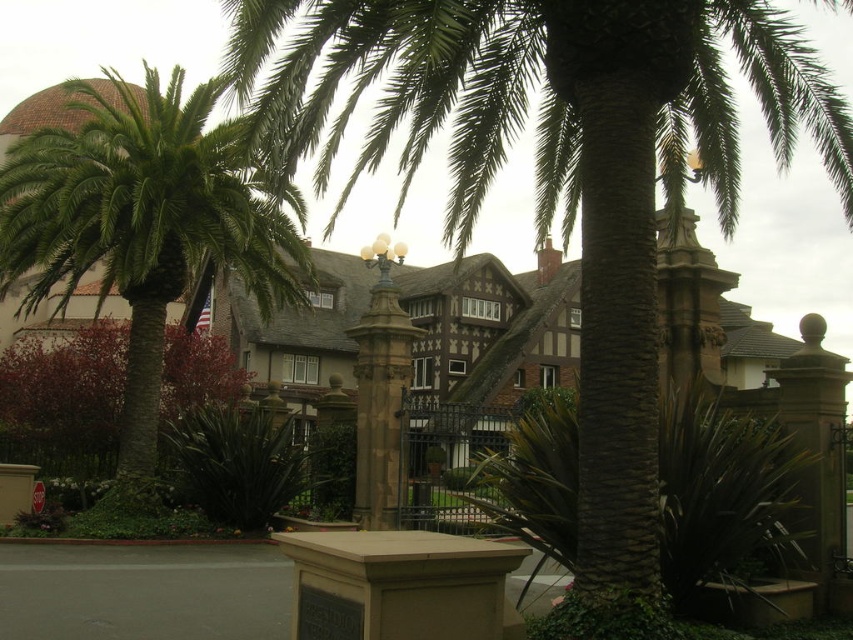
Does green leafy palm tree at center have a lesser height compared to green leafy palm at left?

No.

How much distance is there between green leafy palm tree at center and green leafy palm at left?

The distance of green leafy palm tree at center from green leafy palm at left is 17.62 meters.

Between point (704, 115) and point (264, 289), which one is positioned behind?

Positioned behind is point (264, 289).

Identify the location of green leafy palm tree at center. (556, 168).